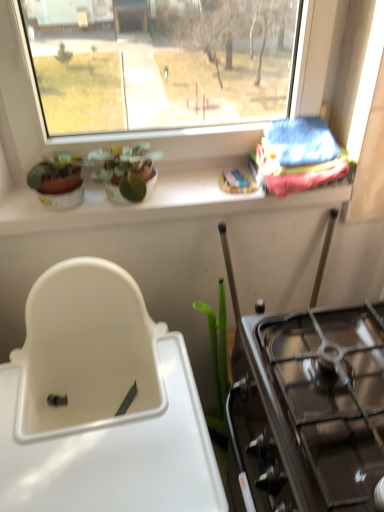
The height and width of the screenshot is (512, 384). In order to click on white plastic sink at lower left in this screenshot , I will do `click(101, 403)`.

Describe the element at coordinates (101, 403) in the screenshot. This screenshot has height=512, width=384. I see `white plastic sink at lower left` at that location.

Image resolution: width=384 pixels, height=512 pixels. Describe the element at coordinates (127, 170) in the screenshot. I see `matte ceramic plant at upper center` at that location.

What is the approximate height of black glass gas stove at right?

It is 7.24 inches.

At what (x,y) coordinates should I click in order to perform the action: click on white ceramic window sill at upper center. Please return your answer as a coordinate pair (x, y). This screenshot has width=384, height=512. Looking at the image, I should click on (149, 203).

Where is `white plastic sink at lower left`? This screenshot has width=384, height=512. white plastic sink at lower left is located at coordinates (101, 403).

Considering the sizes of objects white plastic sink at lower left and black glass gas stove at right in the image provided, who is bigger, white plastic sink at lower left or black glass gas stove at right?

white plastic sink at lower left.

Considering the relative positions of white plastic sink at lower left and black glass gas stove at right in the image provided, is white plastic sink at lower left in front of black glass gas stove at right?

Yes.

Does point (111, 346) come closer to viewer compared to point (381, 478)?

No, (111, 346) is further to viewer.

Does white plastic sink at lower left have a lesser width compared to black glass gas stove at right?

Incorrect, the width of white plastic sink at lower left is not less than that of black glass gas stove at right.

In terms of size, does black glass gas stove at right appear bigger or smaller than matte ceramic plant at upper center?

Considering their sizes, black glass gas stove at right takes up more space than matte ceramic plant at upper center.

Does black glass gas stove at right appear on the left side of matte ceramic plant at upper center?

In fact, black glass gas stove at right is to the right of matte ceramic plant at upper center.

Would you say black glass gas stove at right is outside matte ceramic plant at upper center?

Absolutely, black glass gas stove at right is external to matte ceramic plant at upper center.

From a real-world perspective, does black glass gas stove at right sit lower than matte ceramic plant at upper center?

Indeed, from a real-world perspective, black glass gas stove at right is positioned beneath matte ceramic plant at upper center.

From a real-world perspective, which is physically above, white ceramic window sill at upper center or matte ceramic plant at upper center?

From a 3D spatial view, matte ceramic plant at upper center is above.

In order to click on houseplant on the left of white ceramic window sill at upper center in this screenshot , I will do `click(127, 170)`.

Which of these two, white ceramic window sill at upper center or matte ceramic plant at upper center, is wider?

With larger width is white ceramic window sill at upper center.

From the image's perspective, is white ceramic window sill at upper center above matte ceramic plant at upper center?

No, from the image's perspective, white ceramic window sill at upper center is not above matte ceramic plant at upper center.

Is black glass gas stove at right facing away from white plastic sink at lower left?

No, black glass gas stove at right's orientation is not away from white plastic sink at lower left.

From the image's perspective, is black glass gas stove at right located above or below white plastic sink at lower left?

black glass gas stove at right is situated higher than white plastic sink at lower left in the image.

Is point (351, 400) farther from viewer compared to point (111, 362)?

No, it is not.

Which is in front, black glass gas stove at right or white plastic sink at lower left?

white plastic sink at lower left.

How much distance is there between white ceramic window sill at upper center and white plastic sink at lower left?

13.95 inches.

Which object is closer to the camera taking this photo, white ceramic window sill at upper center or white plastic sink at lower left?

Positioned in front is white plastic sink at lower left.

Which object is positioned more to the left, white ceramic window sill at upper center or white plastic sink at lower left?

white plastic sink at lower left is more to the left.

Is white ceramic window sill at upper center bigger or smaller than white plastic sink at lower left?

In the image, white ceramic window sill at upper center appears to be smaller than white plastic sink at lower left.

Considering the relative positions of white ceramic window sill at upper center and black glass gas stove at right in the image provided, is white ceramic window sill at upper center to the left or to the right of black glass gas stove at right?

In the image, white ceramic window sill at upper center appears on the left side of black glass gas stove at right.

Measure the distance between white ceramic window sill at upper center and black glass gas stove at right.

The distance of white ceramic window sill at upper center from black glass gas stove at right is 18.79 inches.

How many degrees apart are the facing directions of white ceramic window sill at upper center and black glass gas stove at right?

89.4 degrees separate the facing orientations of white ceramic window sill at upper center and black glass gas stove at right.

From a real-world perspective, is white ceramic window sill at upper center positioned under black glass gas stove at right based on gravity?

No, from a real-world perspective, white ceramic window sill at upper center is not below black glass gas stove at right.

In terms of height, does matte ceramic plant at upper center look taller or shorter compared to white ceramic window sill at upper center?

Considering their sizes, matte ceramic plant at upper center has more height than white ceramic window sill at upper center.

Is matte ceramic plant at upper center bigger or smaller than white ceramic window sill at upper center?

In the image, matte ceramic plant at upper center appears to be smaller than white ceramic window sill at upper center.

From a real-world perspective, is matte ceramic plant at upper center beneath white ceramic window sill at upper center?

No.

Does matte ceramic plant at upper center have a lesser width compared to white ceramic window sill at upper center?

Correct, the width of matte ceramic plant at upper center is less than that of white ceramic window sill at upper center.

Image resolution: width=384 pixels, height=512 pixels. I want to click on gas stove above the white plastic sink at lower left (from a real-world perspective), so click(x=324, y=400).

Identify the location of houseplant that appears on the left of black glass gas stove at right. The width and height of the screenshot is (384, 512). (127, 170).

When comparing their distances from blue fabric at upper right, does white ceramic window sill at upper center or matte ceramic plant at upper center seem further?

matte ceramic plant at upper center.

Based on their spatial positions, is black glass gas stove at right or white plastic sink at lower left further from blue fabric at upper right?

white plastic sink at lower left is further to blue fabric at upper right.

From the image, which object appears to be nearer to white ceramic window sill at upper center, black glass gas stove at right or blue fabric at upper right?

blue fabric at upper right lies closer to white ceramic window sill at upper center than the other object.

Considering their positions, is black glass gas stove at right positioned further to white plastic sink at lower left than matte ceramic plant at upper center?

matte ceramic plant at upper center is positioned further to the anchor white plastic sink at lower left.

From the image, which object appears to be farther from white plastic sink at lower left, white ceramic window sill at upper center or black glass gas stove at right?

Based on the image, white ceramic window sill at upper center appears to be further to white plastic sink at lower left.

Looking at the image, which one is located closer to matte ceramic plant at upper center, white plastic sink at lower left or black glass gas stove at right?

white plastic sink at lower left is positioned closer to the anchor matte ceramic plant at upper center.

When comparing their distances from black glass gas stove at right, does blue fabric at upper right or white ceramic window sill at upper center seem closer?

blue fabric at upper right.

Which object lies nearer to the anchor point white ceramic window sill at upper center, white plastic sink at lower left or black glass gas stove at right?

Based on the image, white plastic sink at lower left appears to be nearer to white ceramic window sill at upper center.

Identify the location of material positioned between black glass gas stove at right and white ceramic window sill at upper center from near to far. The height and width of the screenshot is (512, 384). (298, 156).

Where is `gas stove between white ceramic window sill at upper center and white plastic sink at lower left in the vertical direction`? This screenshot has width=384, height=512. gas stove between white ceramic window sill at upper center and white plastic sink at lower left in the vertical direction is located at coordinates (324, 400).

Locate an element on the screen. This screenshot has height=512, width=384. window sill that lies between matte ceramic plant at upper center and white plastic sink at lower left from top to bottom is located at coordinates (149, 203).

This screenshot has height=512, width=384. Identify the location of houseplant between black glass gas stove at right and white ceramic window sill at upper center along the z-axis. (127, 170).